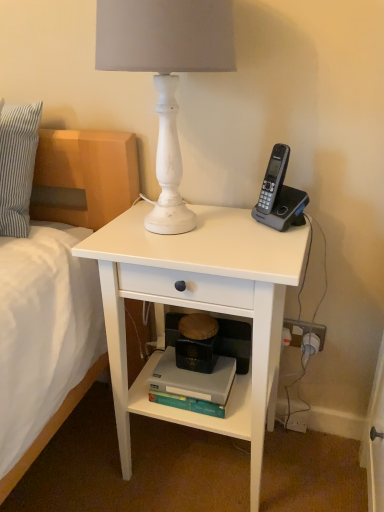
Identify the location of vacant space to the right of white matte lamp at upper center. This screenshot has height=512, width=384. (260, 234).